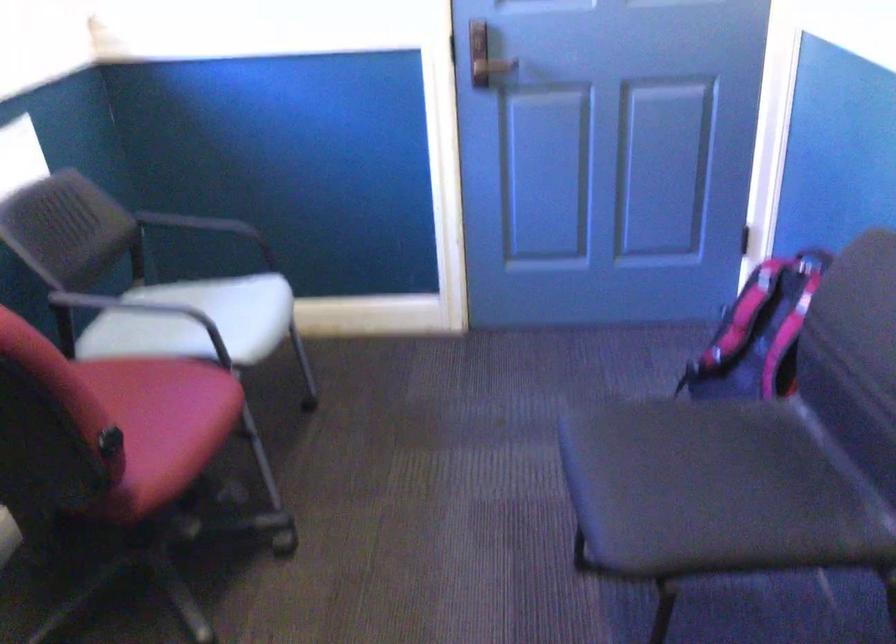
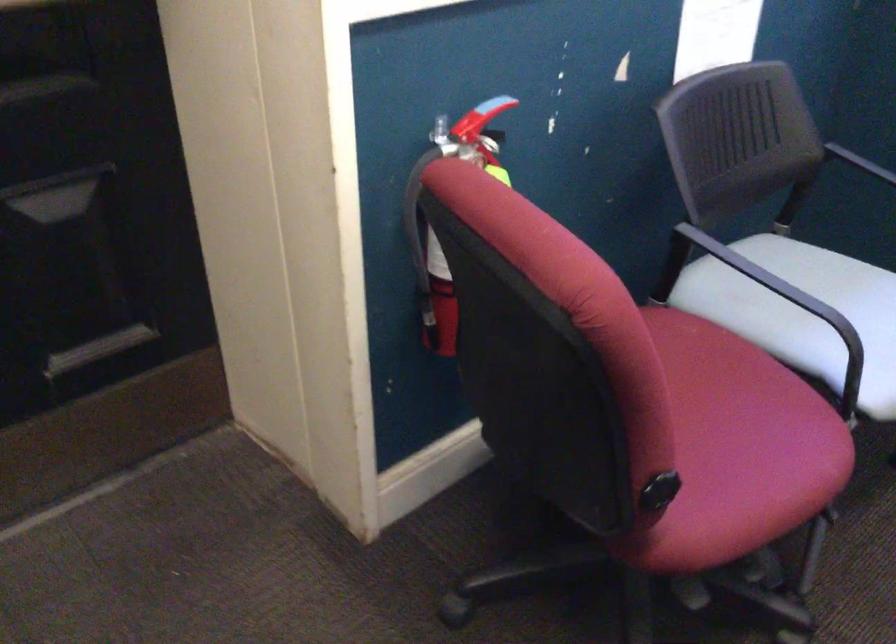
Find the pixel in the second image that matches [118,433] in the first image.

(658, 494)